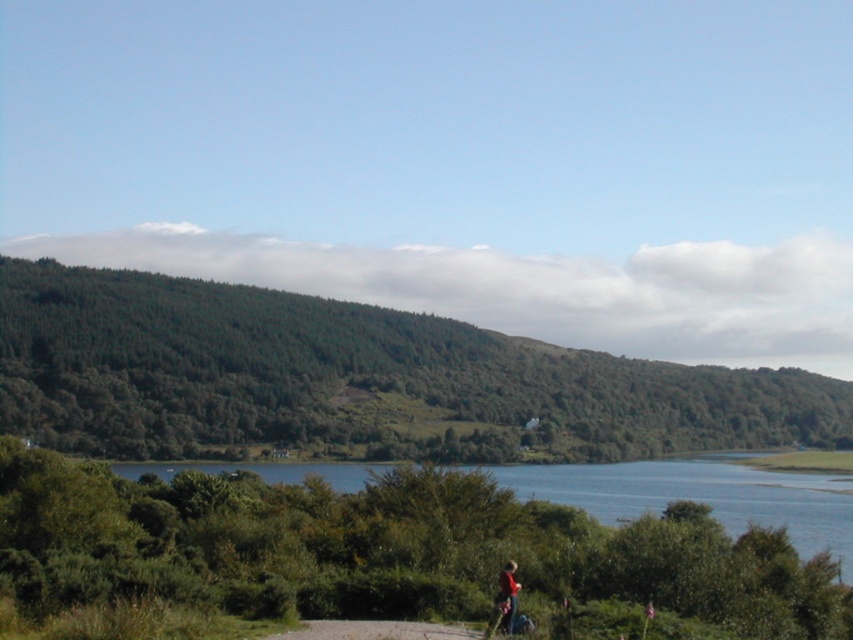
Can you confirm if green leafy hill at center is shorter than red fabric jacket at lower right?

In fact, green leafy hill at center may be taller than red fabric jacket at lower right.

Does green leafy hill at center appear on the right side of red fabric jacket at lower right?

Yes, green leafy hill at center is to the right of red fabric jacket at lower right.

Between point (479, 396) and point (503, 604), which one is positioned behind?

The point (479, 396) is more distant.

Where is `green leafy hill at center`? This screenshot has height=640, width=853. green leafy hill at center is located at coordinates (354, 380).

Is blue water at center bigger than red fabric jacket at lower right?

Yes.

Does point (793, 509) come closer to viewer compared to point (500, 621)?

No, (793, 509) is behind (500, 621).

Which is in front, point (653, 465) or point (498, 584)?

Positioned in front is point (498, 584).

At what (x,y) coordinates should I click in order to perform the action: click on blue water at center. Please return your answer as a coordinate pair (x, y). This screenshot has height=640, width=853. Looking at the image, I should click on (700, 497).

Is green leafy hill at center further to camera compared to blue water at center?

Yes, it is.

What do you see at coordinates (354, 380) in the screenshot? The width and height of the screenshot is (853, 640). I see `green leafy hill at center` at bounding box center [354, 380].

Measure the distance between point (180, 298) and camera.

Point (180, 298) is 1354.07 feet away from camera.

Identify the location of green leafy hill at center. The width and height of the screenshot is (853, 640). (354, 380).